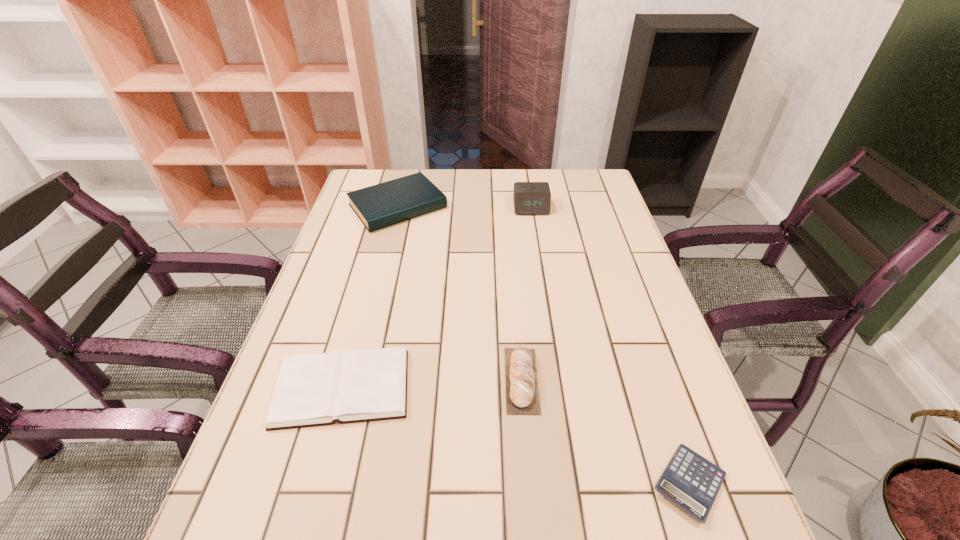
At what (x,y) coordinates should I click in order to perform the action: click on free space between the shorter hardback book and the alarm clock. Please return your answer as a coordinate pair (x, y). Looking at the image, I should click on (437, 298).

I want to click on vacant area that lies between the alarm clock and the pita bread, so click(x=526, y=294).

The image size is (960, 540). In order to click on free space between the nearer hardback book and the tallest object in this screenshot , I will do `click(437, 298)`.

Find the location of a particular element. The width and height of the screenshot is (960, 540). free space between the nearer hardback book and the taller hardback book is located at coordinates (371, 297).

Image resolution: width=960 pixels, height=540 pixels. Find the location of `free space between the shortest object and the taller hardback book`. free space between the shortest object and the taller hardback book is located at coordinates (543, 345).

Find the location of `vacant area that lies between the shorter hardback book and the alarm clock`. vacant area that lies between the shorter hardback book and the alarm clock is located at coordinates (437, 298).

I want to click on free space that is in between the pita bread and the shortest object, so click(606, 431).

Locate an element on the screen. The width and height of the screenshot is (960, 540). vacant space in between the pita bread and the alarm clock is located at coordinates (526, 294).

Find the location of `vacant area that lies between the farther hardback book and the tallest object`. vacant area that lies between the farther hardback book and the tallest object is located at coordinates (465, 207).

Image resolution: width=960 pixels, height=540 pixels. Identify the location of object that is the nearest to the rightmost object. (522, 392).